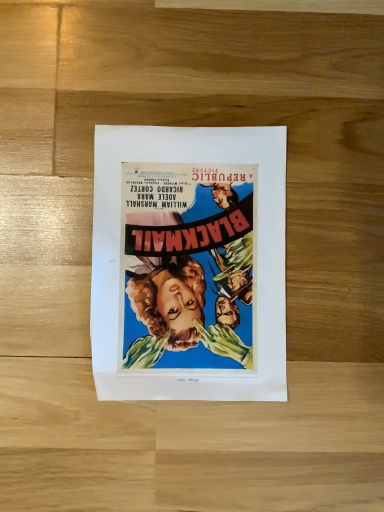
You are a GUI agent. You are given a task and a screenshot of the screen. Output one action in this format:
    pyautogui.click(x=<x>, y=<y>)
    Task: Click on the matte paper poster at center
    The image size is (384, 512).
    Given the screenshot: What is the action you would take?
    pyautogui.click(x=189, y=263)

The image size is (384, 512). What do you see at coordinates (189, 263) in the screenshot?
I see `matte paper poster at center` at bounding box center [189, 263].

The image size is (384, 512). I want to click on matte paper poster at center, so click(189, 263).